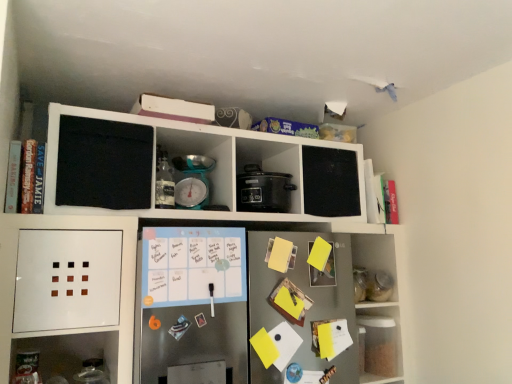
Question: From a real-world perspective, is teal plastic scale at center, which is counted as the 1th appliance, starting from the left, below hardcover book at left, the third book positioned from the right?

Choices:
 (A) no
 (B) yes

Answer: (A)

Question: Is teal plastic scale at center, which is counted as the 1th appliance, starting from the left, located outside hardcover book at left, positioned as the 3th book in back-to-front order?

Choices:
 (A) yes
 (B) no

Answer: (A)

Question: Is teal plastic scale at center, the 2th appliance when ordered from right to left, bigger than hardcover book at left, the 1th book viewed from the front?

Choices:
 (A) yes
 (B) no

Answer: (A)

Question: Is teal plastic scale at center, which is counted as the 1th appliance, starting from the left, positioned before hardcover book at left, arranged as the 1th book when viewed from the left?

Choices:
 (A) yes
 (B) no

Answer: (B)

Question: Is teal plastic scale at center, which is counted as the 1th appliance, starting from the left, turned away from hardcover book at left, the 1th book viewed from the front?

Choices:
 (A) no
 (B) yes

Answer: (A)

Question: Is hardcover book at left, the third book positioned from the right, a part of teal plastic scale at center, which is counted as the 1th appliance, starting from the left?

Choices:
 (A) yes
 (B) no

Answer: (B)

Question: Is yellow paper at center, which is the 2th book in left-to-right order, outside hardcover book at left, the third book positioned from the right?

Choices:
 (A) no
 (B) yes

Answer: (B)

Question: Can hardcover book at left, the 1th book viewed from the front, be found inside yellow paper at center, placed as the 2th book when sorted from front to back?

Choices:
 (A) no
 (B) yes

Answer: (A)

Question: From the image's perspective, would you say yellow paper at center, which is the 2th book in left-to-right order, is shown under hardcover book at left, positioned as the 3th book in back-to-front order?

Choices:
 (A) yes
 (B) no

Answer: (A)

Question: From the image's perspective, is yellow paper at center, the second book from the right, over hardcover book at left, the third book positioned from the right?

Choices:
 (A) no
 (B) yes

Answer: (A)

Question: Is yellow paper at center, the second book from the right, thinner than hardcover book at left, positioned as the 3th book in back-to-front order?

Choices:
 (A) no
 (B) yes

Answer: (B)

Question: From a real-world perspective, is yellow paper at center, which is the 2th book in left-to-right order, below hardcover book at left, positioned as the 3th book in back-to-front order?

Choices:
 (A) no
 (B) yes

Answer: (B)

Question: Is clear plastic container at lower right, the second shelf positioned from the left, positioned in front of teal plastic scale at center, the 2th appliance when ordered from right to left?

Choices:
 (A) no
 (B) yes

Answer: (A)